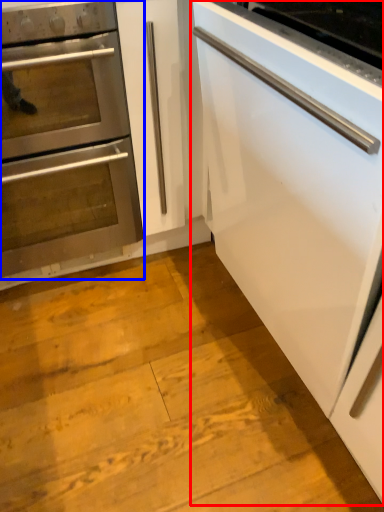
Question: Among these objects, which one is nearest to the camera, cabinetry (highlighted by a red box) or oven (highlighted by a blue box)?

Choices:
 (A) cabinetry
 (B) oven

Answer: (A)